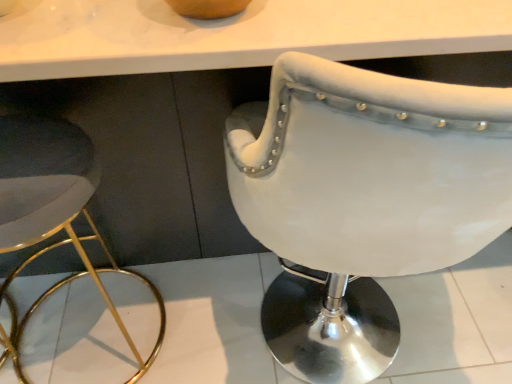
I want to click on free point below white leather stool at left (from a real-world perspective), so click(x=93, y=346).